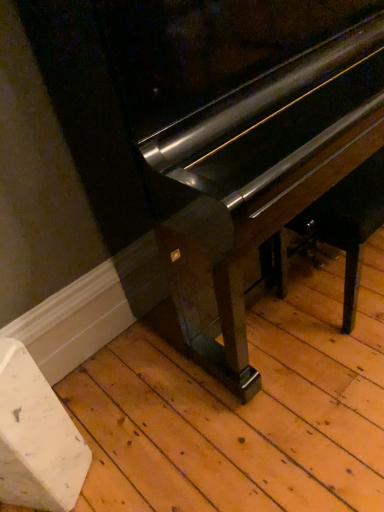
Describe the element at coordinates (348, 223) in the screenshot. I see `wooden music stool at lower right` at that location.

The image size is (384, 512). Find the location of `wooden music stool at lower right`. wooden music stool at lower right is located at coordinates (348, 223).

Measure the distance between wooden music stool at lower right and camera.

The depth of wooden music stool at lower right is 1.15 meters.

Where is `wooden music stool at lower right`? The height and width of the screenshot is (512, 384). wooden music stool at lower right is located at coordinates coord(348,223).